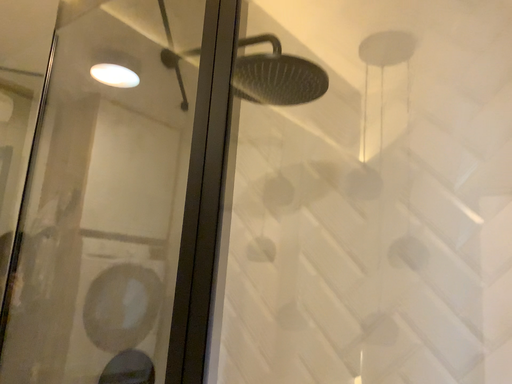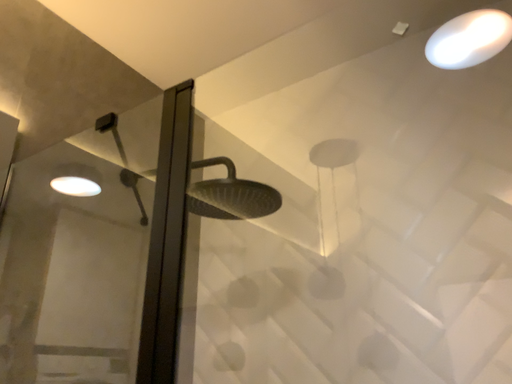
Question: Which way did the camera rotate in the video?

Choices:
 (A) rotated upward
 (B) rotated downward

Answer: (A)